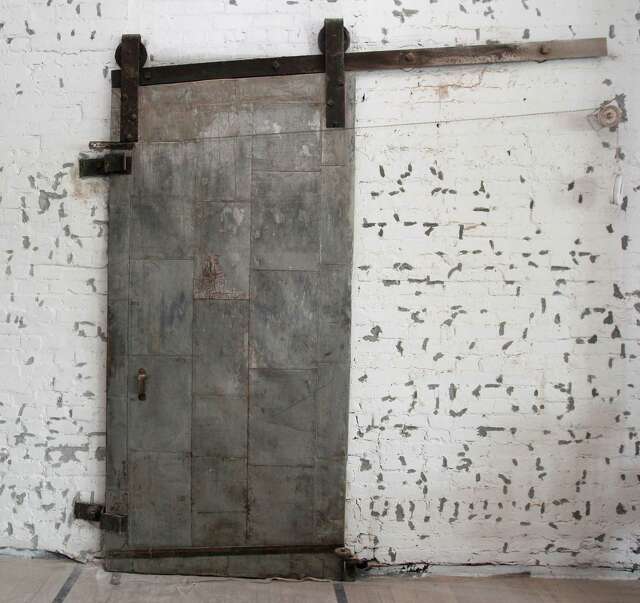
Find the location of `door handle`. door handle is located at coordinates (141, 386).